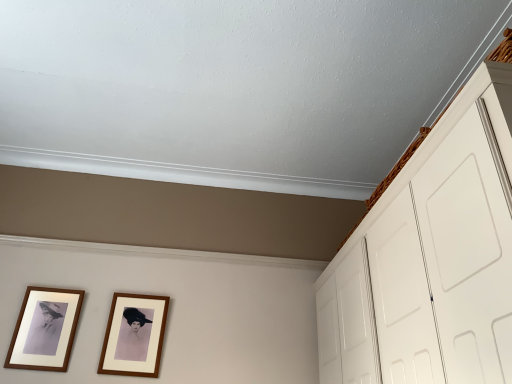
Find the location of a particular element. This screenshot has width=512, height=384. brown wooden picture frame at center, positioned as the 2th picture frame in left-to-right order is located at coordinates (134, 335).

This screenshot has width=512, height=384. What do you see at coordinates (431, 258) in the screenshot? I see `white matte cabinet at upper right` at bounding box center [431, 258].

What do you see at coordinates (45, 329) in the screenshot? I see `wooden framed photo at lower left, marked as the first picture frame in a left-to-right arrangement` at bounding box center [45, 329].

Image resolution: width=512 pixels, height=384 pixels. In order to click on brown wooden picture frame at center, the first picture frame when ordered from right to left in this screenshot , I will do `click(134, 335)`.

Between wooden framed photo at lower left, marked as the first picture frame in a left-to-right arrangement, and white matte cabinet at upper right, which one is positioned behind?

wooden framed photo at lower left, marked as the first picture frame in a left-to-right arrangement, is further from the camera.

Which is less distant, (58,330) or (386,372)?

Point (58,330).

Are wooden framed photo at lower left, marked as the first picture frame in a left-to-right arrangement, and white matte cabinet at upper right located far from each other?

Indeed, wooden framed photo at lower left, marked as the first picture frame in a left-to-right arrangement, is not near white matte cabinet at upper right.

Is brown wooden picture frame at center, the first picture frame when ordered from right to left, with white matte cabinet at upper right?

No, brown wooden picture frame at center, the first picture frame when ordered from right to left, is not beside white matte cabinet at upper right.

Which object is further away from the camera, brown wooden picture frame at center, positioned as the 2th picture frame in left-to-right order, or white matte cabinet at upper right?

brown wooden picture frame at center, positioned as the 2th picture frame in left-to-right order, is more distant.

Starting from the white matte cabinet at upper right, which picture frame is the 1st one to the left? Please provide its 2D coordinates.

[(134, 335)]

Is point (129, 349) positioned before point (461, 198)?

No, it is behind (461, 198).

Based on the photo, considering their positions, is wooden framed photo at lower left, marked as the first picture frame in a left-to-right arrangement, located in front of or behind brown wooden picture frame at center, the first picture frame when ordered from right to left?

wooden framed photo at lower left, marked as the first picture frame in a left-to-right arrangement, is in front of brown wooden picture frame at center, the first picture frame when ordered from right to left.

From the image's perspective, which object appears higher, wooden framed photo at lower left, marked as the first picture frame in a left-to-right arrangement, or brown wooden picture frame at center, positioned as the 2th picture frame in left-to-right order?

wooden framed photo at lower left, marked as the first picture frame in a left-to-right arrangement, is shown above in the image.

From a real-world perspective, is wooden framed photo at lower left, the 2th picture frame positioned from the right, positioned above or below brown wooden picture frame at center, positioned as the 2th picture frame in left-to-right order?

wooden framed photo at lower left, the 2th picture frame positioned from the right, is situated higher than brown wooden picture frame at center, positioned as the 2th picture frame in left-to-right order, in the real world.

Is point (31, 313) positioned after point (156, 327)?

No, it is in front of (156, 327).

Does brown wooden picture frame at center, the first picture frame when ordered from right to left, touch wooden framed photo at lower left, marked as the first picture frame in a left-to-right arrangement?

No, brown wooden picture frame at center, the first picture frame when ordered from right to left, is not touching wooden framed photo at lower left, marked as the first picture frame in a left-to-right arrangement.

Considering the sizes of objects brown wooden picture frame at center, the first picture frame when ordered from right to left, and wooden framed photo at lower left, marked as the first picture frame in a left-to-right arrangement, in the image provided, who is wider, brown wooden picture frame at center, the first picture frame when ordered from right to left, or wooden framed photo at lower left, marked as the first picture frame in a left-to-right arrangement,?

With larger width is brown wooden picture frame at center, the first picture frame when ordered from right to left.

What's the angular difference between brown wooden picture frame at center, the first picture frame when ordered from right to left, and wooden framed photo at lower left, marked as the first picture frame in a left-to-right arrangement,'s facing directions?

The facing directions of brown wooden picture frame at center, the first picture frame when ordered from right to left, and wooden framed photo at lower left, marked as the first picture frame in a left-to-right arrangement, are 3.12e-05 degrees apart.

Locate an element on the screen. The width and height of the screenshot is (512, 384). picture frame above the brown wooden picture frame at center, the first picture frame when ordered from right to left (from the image's perspective) is located at coordinates (45, 329).

Considering the relative sizes of white matte cabinet at upper right and brown wooden picture frame at center, the first picture frame when ordered from right to left, in the image provided, is white matte cabinet at upper right shorter than brown wooden picture frame at center, the first picture frame when ordered from right to left,?

No.

From a real-world perspective, is white matte cabinet at upper right above or below brown wooden picture frame at center, positioned as the 2th picture frame in left-to-right order?

white matte cabinet at upper right is below brown wooden picture frame at center, positioned as the 2th picture frame in left-to-right order.

Considering the relative sizes of white matte cabinet at upper right and brown wooden picture frame at center, the first picture frame when ordered from right to left, in the image provided, is white matte cabinet at upper right bigger than brown wooden picture frame at center, the first picture frame when ordered from right to left,?

Indeed, white matte cabinet at upper right has a larger size compared to brown wooden picture frame at center, the first picture frame when ordered from right to left.

Is white matte cabinet at upper right not near brown wooden picture frame at center, positioned as the 2th picture frame in left-to-right order?

white matte cabinet at upper right is far away from brown wooden picture frame at center, positioned as the 2th picture frame in left-to-right order.

Could you tell me if white matte cabinet at upper right is facing wooden framed photo at lower left, marked as the first picture frame in a left-to-right arrangement?

Yes, white matte cabinet at upper right faces towards wooden framed photo at lower left, marked as the first picture frame in a left-to-right arrangement.

Is white matte cabinet at upper right beside wooden framed photo at lower left, marked as the first picture frame in a left-to-right arrangement?

white matte cabinet at upper right and wooden framed photo at lower left, marked as the first picture frame in a left-to-right arrangement, are not in contact.

At what (x,y) coordinates should I click in order to perform the action: click on the 1st picture frame behind the white matte cabinet at upper right, starting your count from the anchor. Please return your answer as a coordinate pair (x, y). This screenshot has width=512, height=384. Looking at the image, I should click on tap(45, 329).

In terms of height, does white matte cabinet at upper right look taller or shorter compared to wooden framed photo at lower left, marked as the first picture frame in a left-to-right arrangement?

white matte cabinet at upper right is taller than wooden framed photo at lower left, marked as the first picture frame in a left-to-right arrangement.

Locate an element on the screen. The height and width of the screenshot is (384, 512). dresser lying in front of the wooden framed photo at lower left, the 2th picture frame positioned from the right is located at coordinates (431, 258).

Locate an element on the screen. This screenshot has height=384, width=512. the 2nd picture frame below the white matte cabinet at upper right (from the image's perspective) is located at coordinates (134, 335).

Which object lies further to the anchor point white matte cabinet at upper right, wooden framed photo at lower left, marked as the first picture frame in a left-to-right arrangement, or brown wooden picture frame at center, positioned as the 2th picture frame in left-to-right order?

Based on the image, wooden framed photo at lower left, marked as the first picture frame in a left-to-right arrangement, appears to be further to white matte cabinet at upper right.

Based on their spatial positions, is brown wooden picture frame at center, positioned as the 2th picture frame in left-to-right order, or white matte cabinet at upper right further from wooden framed photo at lower left, the 2th picture frame positioned from the right?

white matte cabinet at upper right is positioned further to the anchor wooden framed photo at lower left, the 2th picture frame positioned from the right.

From the image, which object appears to be farther from brown wooden picture frame at center, the first picture frame when ordered from right to left, wooden framed photo at lower left, the 2th picture frame positioned from the right, or white matte cabinet at upper right?

white matte cabinet at upper right is further to brown wooden picture frame at center, the first picture frame when ordered from right to left.

From the image, which object appears to be nearer to white matte cabinet at upper right, brown wooden picture frame at center, positioned as the 2th picture frame in left-to-right order, or wooden framed photo at lower left, marked as the first picture frame in a left-to-right arrangement?

brown wooden picture frame at center, positioned as the 2th picture frame in left-to-right order, is positioned closer to the anchor white matte cabinet at upper right.

Based on their spatial positions, is white matte cabinet at upper right or wooden framed photo at lower left, marked as the first picture frame in a left-to-right arrangement, closer to brown wooden picture frame at center, the first picture frame when ordered from right to left?

The object closer to brown wooden picture frame at center, the first picture frame when ordered from right to left, is wooden framed photo at lower left, marked as the first picture frame in a left-to-right arrangement.

When comparing their distances from wooden framed photo at lower left, marked as the first picture frame in a left-to-right arrangement, does white matte cabinet at upper right or brown wooden picture frame at center, the first picture frame when ordered from right to left, seem closer?

brown wooden picture frame at center, the first picture frame when ordered from right to left, is positioned closer to the anchor wooden framed photo at lower left, marked as the first picture frame in a left-to-right arrangement.

At what (x,y) coordinates should I click in order to perform the action: click on picture frame between wooden framed photo at lower left, the 2th picture frame positioned from the right, and white matte cabinet at upper right from left to right. Please return your answer as a coordinate pair (x, y). Looking at the image, I should click on (134, 335).